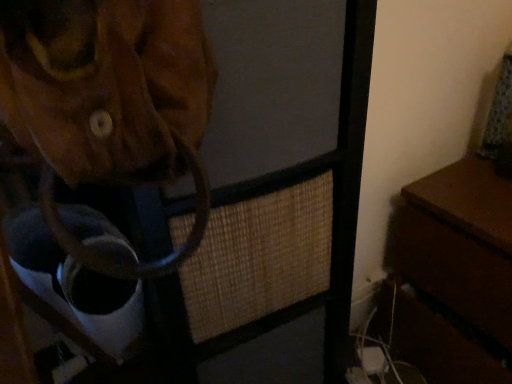
Image resolution: width=512 pixels, height=384 pixels. Find the location of `brown leather bag at upper left`. brown leather bag at upper left is located at coordinates (285, 168).

Describe the element at coordinates (285, 168) in the screenshot. Image resolution: width=512 pixels, height=384 pixels. I see `brown leather bag at upper left` at that location.

This screenshot has height=384, width=512. Describe the element at coordinates (458, 243) in the screenshot. I see `brown wooden table at right` at that location.

What is the approximate height of brown wooden table at right?

brown wooden table at right is 20.98 inches tall.

Locate an element on the screen. brown wooden table at right is located at coordinates (458, 243).

Image resolution: width=512 pixels, height=384 pixels. I want to click on brown leather bag at upper left, so click(x=285, y=168).

Is brown leather bag at upper left to the right of brown wooden table at right from the viewer's perspective?

Incorrect, brown leather bag at upper left is not on the right side of brown wooden table at right.

Which object is further away from the camera taking this photo, brown leather bag at upper left or brown wooden table at right?

Positioned behind is brown wooden table at right.

Which is behind, point (367, 87) or point (449, 377)?

The point (449, 377) is farther from the camera.

From the image's perspective, which is above, brown leather bag at upper left or brown wooden table at right?

brown leather bag at upper left, from the image's perspective.

From a real-world perspective, relative to brown wooden table at right, is brown leather bag at upper left vertically above or below?

brown leather bag at upper left is situated higher than brown wooden table at right in the real world.

Between brown leather bag at upper left and brown wooden table at right, which one has larger width?

brown wooden table at right is wider.

Is brown leather bag at upper left shorter than brown wooden table at right?

Incorrect, the height of brown leather bag at upper left does not fall short of that of brown wooden table at right.

Which of these two, brown leather bag at upper left or brown wooden table at right, is bigger?

brown leather bag at upper left.

Is brown leather bag at upper left spatially inside brown wooden table at right, or outside of it?

brown leather bag at upper left is not inside brown wooden table at right, it's outside.

Is there a large distance between brown leather bag at upper left and brown wooden table at right?

No, there isn't a large distance between brown leather bag at upper left and brown wooden table at right.

Is brown leather bag at upper left turned away from brown wooden table at right?

No, brown wooden table at right is not at the back of brown leather bag at upper left.

In the image, there is a brown wooden table at right. Where is `furniture above it (from the image's perspective)`? Image resolution: width=512 pixels, height=384 pixels. furniture above it (from the image's perspective) is located at coordinates (285, 168).

Which object is positioned more to the right, brown wooden table at right or brown leather bag at upper left?

brown wooden table at right.

Is brown wooden table at right positioned in front of brown leather bag at upper left?

No, the depth of brown wooden table at right is greater than that of brown leather bag at upper left.

Is point (404, 340) positioned before point (183, 359)?

No, (404, 340) is further to viewer.

From the image's perspective, does brown wooden table at right appear higher than brown leather bag at upper left?

No.

From a real-world perspective, between brown wooden table at right and brown leather bag at upper left, who is vertically higher?

From a 3D spatial view, brown leather bag at upper left is above.

Looking at their sizes, would you say brown wooden table at right is wider or thinner than brown leather bag at upper left?

Clearly, brown wooden table at right has more width compared to brown leather bag at upper left.

Which of these two, brown wooden table at right or brown leather bag at upper left, stands taller?

brown leather bag at upper left is taller.

Who is smaller, brown wooden table at right or brown leather bag at upper left?

With smaller size is brown wooden table at right.

Is brown wooden table at right not inside brown leather bag at upper left?

Yes, brown wooden table at right is outside of brown leather bag at upper left.

Are brown wooden table at right and brown leather bag at upper left beside each other?

brown wooden table at right and brown leather bag at upper left are clearly separated.

Does brown wooden table at right turn towards brown leather bag at upper left?

Yes, brown wooden table at right is turned towards brown leather bag at upper left.

How far apart are brown wooden table at right and brown leather bag at upper left?

A distance of 13.52 inches exists between brown wooden table at right and brown leather bag at upper left.

Find the location of a particular element. This screenshot has height=384, width=512. furniture located on the left of brown wooden table at right is located at coordinates (285, 168).

Where is `table below the brown leather bag at upper left (from a real-world perspective)`? The height and width of the screenshot is (384, 512). table below the brown leather bag at upper left (from a real-world perspective) is located at coordinates (458, 243).

You are a GUI agent. You are given a task and a screenshot of the screen. Output one action in this format:
    pyautogui.click(x=<x>, y=<y>)
    Task: Click on the furniture above the brown wooden table at right (from a real-world perspective)
    
    Given the screenshot: What is the action you would take?
    pyautogui.click(x=285, y=168)